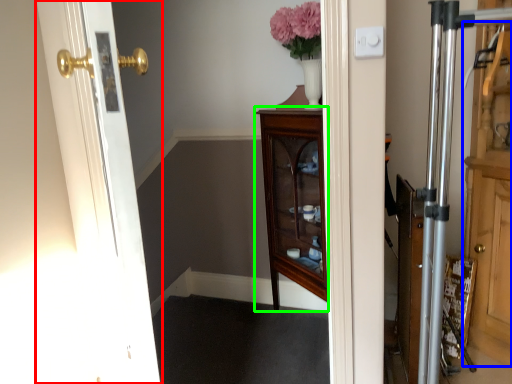
Question: Which is farther away from door (highlighted by a red box)? dresser (highlighted by a blue box) or furniture (highlighted by a green box)?

Choices:
 (A) dresser
 (B) furniture

Answer: (A)